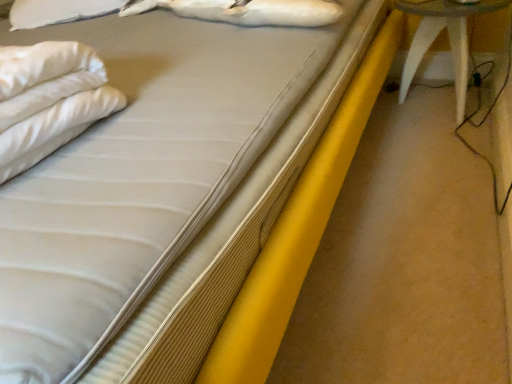
At what (x,y) coordinates should I click in order to perform the action: click on free space in front of white plastic stool at right. Please return your answer as a coordinate pair (x, y). Looking at the image, I should click on (439, 143).